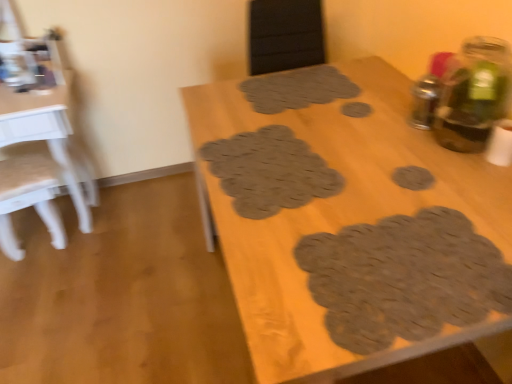
The width and height of the screenshot is (512, 384). Identify the location of vacant space that is in between brown felt coaster at center, acting as the 2th footprint starting from the top, and brown textured coaster at center-right, the third footprint positioned from the front. (387, 145).